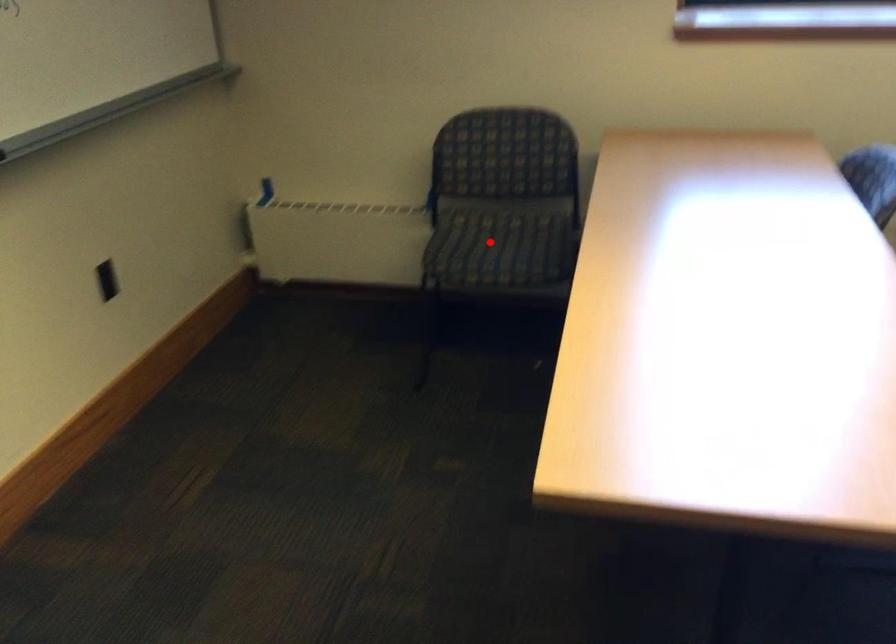
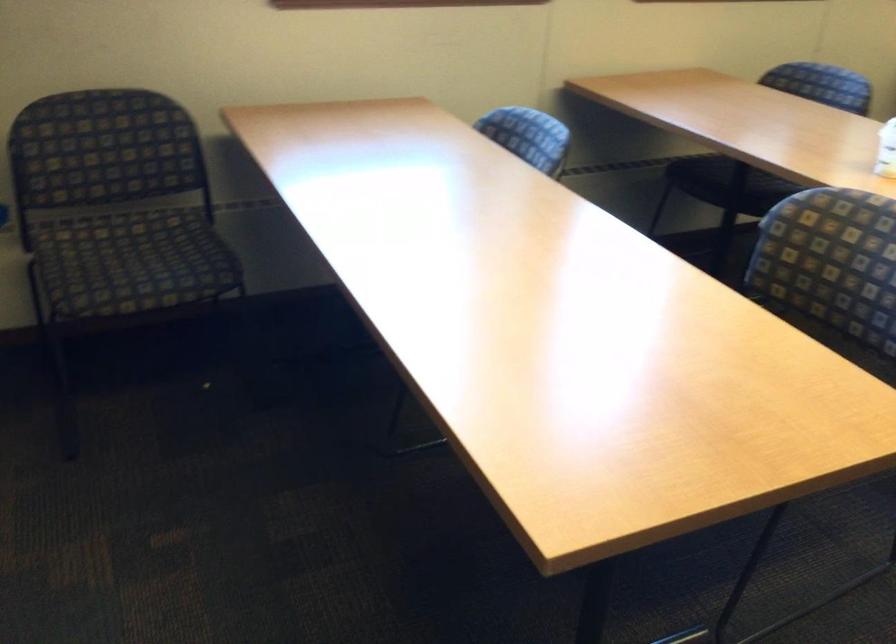
The point at the highlighted location is marked in the first image. Where is the corresponding point in the second image?

(131, 261)